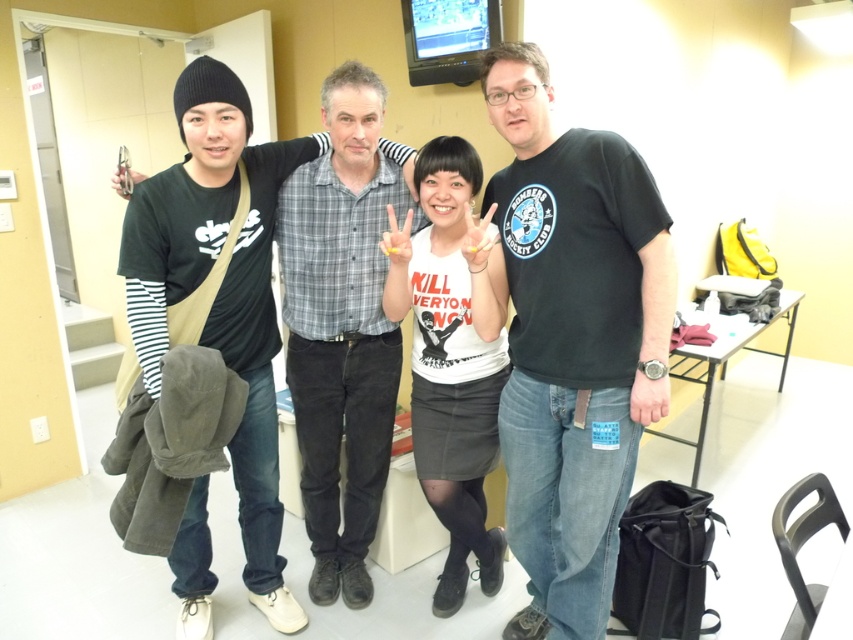
Does black cotton t-shirt at center have a lesser width compared to black cotton shirt at center?

Indeed, black cotton t-shirt at center has a lesser width compared to black cotton shirt at center.

Between black cotton t-shirt at center and black cotton shirt at center, which one appears on the right side from the viewer's perspective?

From the viewer's perspective, black cotton t-shirt at center appears more on the right side.

Which is behind, point (595, 621) or point (254, 500)?

The point (254, 500) is behind.

Find the location of a particular element. black cotton t-shirt at center is located at coordinates (573, 340).

Which of these two, black cotton t-shirt at center or gray plaid shirt at center, stands shorter?

black cotton t-shirt at center is shorter.

Which of these two, black cotton t-shirt at center or gray plaid shirt at center, stands taller?

gray plaid shirt at center is taller.

The image size is (853, 640). What do you see at coordinates (573, 340) in the screenshot?
I see `black cotton t-shirt at center` at bounding box center [573, 340].

The height and width of the screenshot is (640, 853). I want to click on black cotton t-shirt at center, so click(573, 340).

Looking at this image, who is positioned more to the right, gray plaid shirt at center or white matte shirt at center?

white matte shirt at center

Does point (334, 99) come closer to viewer compared to point (436, 332)?

Yes, it is in front of point (436, 332).

Between point (335, 180) and point (492, 417), which one is positioned behind?

The point (492, 417) is behind.

The height and width of the screenshot is (640, 853). What are the coordinates of `gray plaid shirt at center` in the screenshot? It's located at (341, 326).